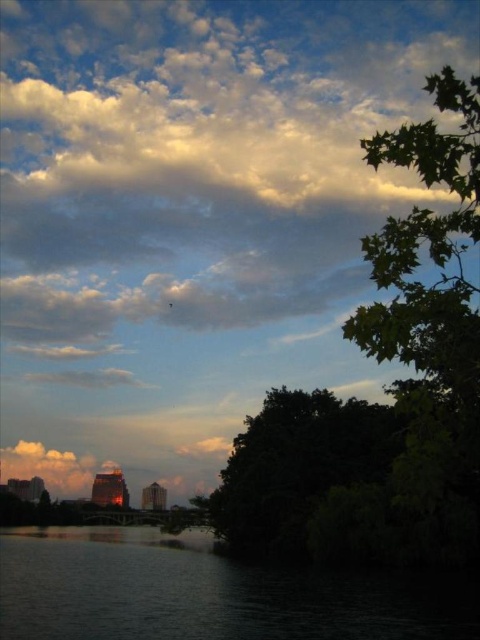
Can you confirm if green leafy tree at upper right is wider than dark water at lower left?

In fact, green leafy tree at upper right might be narrower than dark water at lower left.

How much distance is there between green leafy tree at upper right and dark water at lower left?

They are 60.02 feet apart.

The height and width of the screenshot is (640, 480). I want to click on green leafy tree at upper right, so click(386, 390).

Consider the image. Does dark water at lower left come behind dark green leafy tree at lower right?

No, dark water at lower left is in front of dark green leafy tree at lower right.

Is dark water at lower left above dark green leafy tree at lower right?

Incorrect, dark water at lower left is not positioned above dark green leafy tree at lower right.

Identify the location of dark water at lower left. The width and height of the screenshot is (480, 640). (201, 593).

Is green leafy tree at upper right below dark green leafy tree at lower right?

Actually, green leafy tree at upper right is above dark green leafy tree at lower right.

Does green leafy tree at upper right have a smaller size compared to dark green leafy tree at lower right?

No, green leafy tree at upper right is not smaller than dark green leafy tree at lower right.

Between point (440, 442) and point (377, 460), which one is positioned behind?

The point (377, 460) is behind.

This screenshot has height=640, width=480. I want to click on green leafy tree at upper right, so click(386, 390).